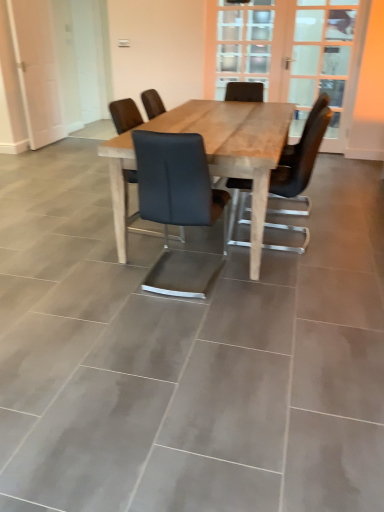
Image resolution: width=384 pixels, height=512 pixels. Identify the location of free spot in front of black leather chair at center, acting as the 2th chair starting from the left. tap(190, 320).